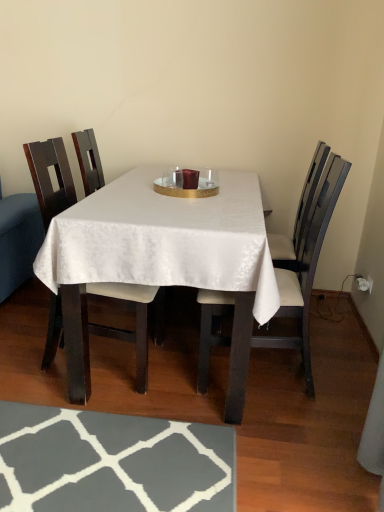
Question: Considering the relative positions of wooden chair at center, which is the 2th chair in left-to-right order, and white satin table at center in the image provided, is wooden chair at center, which is the 2th chair in left-to-right order, in front of white satin table at center?

Choices:
 (A) no
 (B) yes

Answer: (A)

Question: From a real-world perspective, is wooden chair at center, which is the 2th chair in left-to-right order, positioned over white satin table at center based on gravity?

Choices:
 (A) yes
 (B) no

Answer: (A)

Question: From the image's perspective, does wooden chair at center, which ranks as the first chair in right-to-left order, appear lower than white satin table at center?

Choices:
 (A) no
 (B) yes

Answer: (B)

Question: Is wooden chair at center, which is the 2th chair in left-to-right order, to the right of white satin table at center from the viewer's perspective?

Choices:
 (A) yes
 (B) no

Answer: (A)

Question: Is wooden chair at center, which ranks as the first chair in right-to-left order, wider than white satin table at center?

Choices:
 (A) no
 (B) yes

Answer: (A)

Question: Would you say white satin table at center is inside or outside matte wood chair at left, arranged as the 1th chair when viewed from the left?

Choices:
 (A) inside
 (B) outside

Answer: (B)

Question: Is white satin table at center bigger or smaller than matte wood chair at left, which is the 2th chair from right to left?

Choices:
 (A) small
 (B) big

Answer: (B)

Question: In the image, is white satin table at center positioned in front of or behind matte wood chair at left, which is the 2th chair from right to left?

Choices:
 (A) behind
 (B) front

Answer: (B)

Question: Is point (74, 223) closer or farther from the camera than point (86, 130)?

Choices:
 (A) closer
 (B) farther

Answer: (A)

Question: In the image, is wooden chair at center, which is the 2th chair in left-to-right order, positioned in front of or behind white satin table at center?

Choices:
 (A) behind
 (B) front

Answer: (A)

Question: Do you think wooden chair at center, which is the 2th chair in left-to-right order, is within white satin table at center, or outside of it?

Choices:
 (A) outside
 (B) inside

Answer: (B)

Question: Based on their positions, is wooden chair at center, which is the 2th chair in left-to-right order, located to the left or right of white satin table at center?

Choices:
 (A) right
 (B) left

Answer: (A)

Question: Based on their sizes in the image, would you say wooden chair at center, which ranks as the first chair in right-to-left order, is bigger or smaller than white satin table at center?

Choices:
 (A) small
 (B) big

Answer: (A)

Question: In terms of width, does matte wood chair at left, which is the 2th chair from right to left, look wider or thinner when compared to wooden chair at center, which is the 2th chair in left-to-right order?

Choices:
 (A) wide
 (B) thin

Answer: (B)

Question: Is matte wood chair at left, which is the 2th chair from right to left, taller or shorter than wooden chair at center, which is the 2th chair in left-to-right order?

Choices:
 (A) tall
 (B) short

Answer: (B)